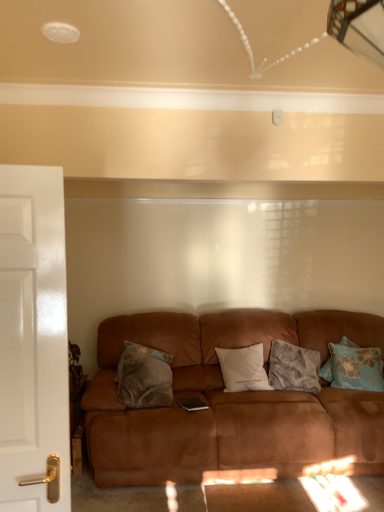
Question: Is white glossy door at left bigger or smaller than fluffy gray pillow at center, the second pillow from the right?

Choices:
 (A) big
 (B) small

Answer: (B)

Question: Considering the positions of point (6, 201) and point (311, 375), is point (6, 201) closer or farther from the camera than point (311, 375)?

Choices:
 (A) farther
 (B) closer

Answer: (B)

Question: Which is farther from the fluffy brown pillow at center, the fourth pillow in the right-to-left sequence?

Choices:
 (A) white glossy door at left
 (B) blue floral pillow at right, the 1th pillow when ordered from right to left
 (C) fluffy gray pillow at center, the second pillow from the right
 (D) suede brown couch at center
 (E) white soft cushion at center, acting as the 2th pillow starting from the left

Answer: (A)

Question: Which is farther from the blue floral pillow at right, the 4th pillow positioned from the left?

Choices:
 (A) white glossy door at left
 (B) white soft cushion at center, acting as the 2th pillow starting from the left
 (C) fluffy gray pillow at center, the second pillow from the right
 (D) suede brown couch at center
 (E) fluffy brown pillow at center, which is counted as the first pillow, starting from the left

Answer: (A)